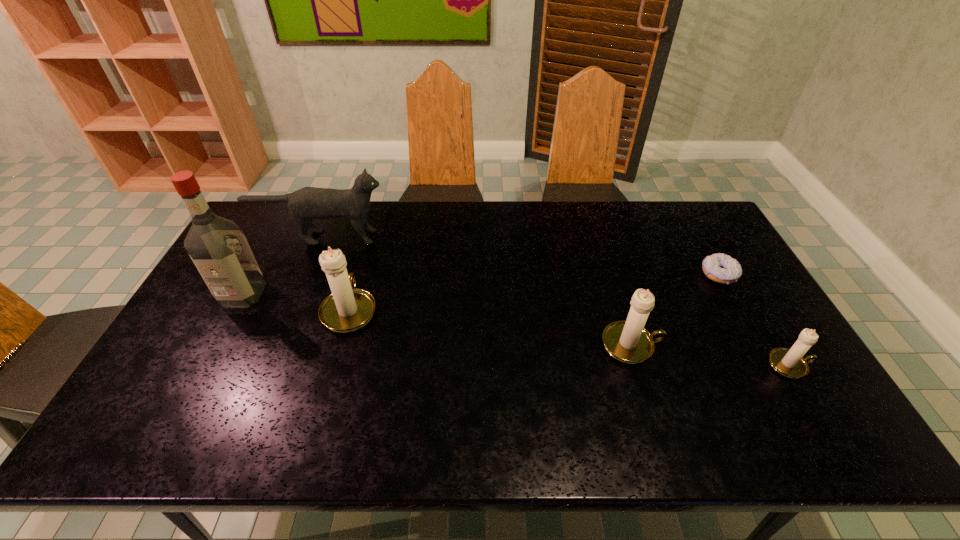
You are a GUI agent. You are given a task and a screenshot of the screen. Output one action in this format:
    pyautogui.click(x=<x>, y=<y>)
    Task: Click on the free space that is in between the shortest candle holder and the farthest object
    
    Given the screenshot: What is the action you would take?
    pyautogui.click(x=556, y=301)

Locate an element on the screen. This screenshot has width=960, height=540. blank region between the leftmost candle holder and the rightmost candle holder is located at coordinates (570, 337).

Where is `vacant region between the leftmost candle holder and the fifth tallest object`? vacant region between the leftmost candle holder and the fifth tallest object is located at coordinates (570, 337).

The height and width of the screenshot is (540, 960). What are the coordinates of `unoccupied position between the fourth tallest object and the shortest object` in the screenshot? It's located at (676, 309).

Image resolution: width=960 pixels, height=540 pixels. What are the coordinates of `vacant area between the farthest object and the doughnut` in the screenshot? It's located at (520, 256).

Identify the location of unoccupied area between the second tallest candle holder and the rightmost candle holder. (711, 355).

Find the location of a particular element. This screenshot has width=960, height=540. free space between the liquor and the fifth tallest object is located at coordinates (516, 329).

Identify the location of vacant area that lies between the shortest candle holder and the second shortest candle holder. The width and height of the screenshot is (960, 540). (711, 355).

In order to click on unoccupied area between the second tallest candle holder and the liquor in this screenshot , I will do `click(438, 319)`.

The height and width of the screenshot is (540, 960). I want to click on blank region between the cat and the fifth tallest object, so click(556, 301).